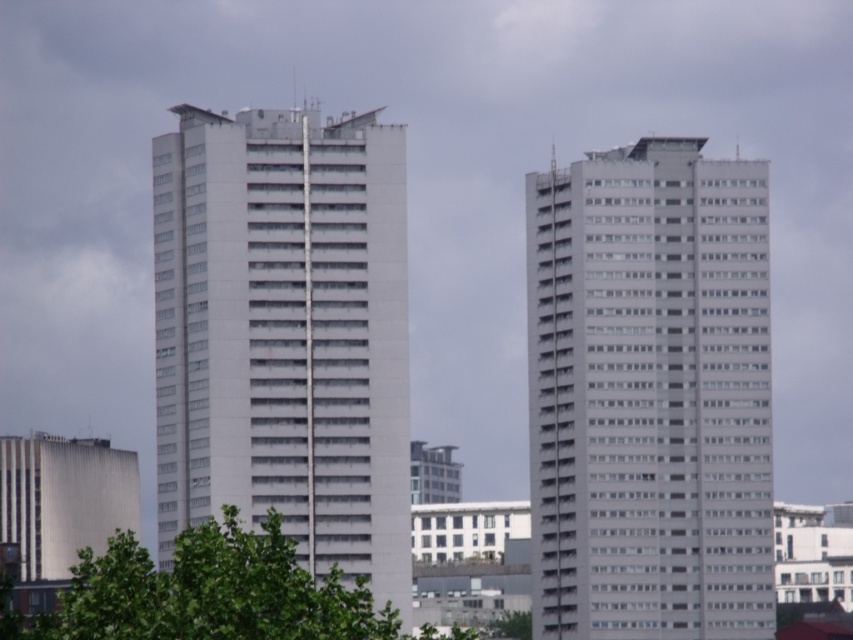
Question: Is white smooth building at right further to the viewer compared to white smooth building at center?

Choices:
 (A) yes
 (B) no

Answer: (A)

Question: Which point appears farthest from the camera in this image?

Choices:
 (A) (610, 214)
 (B) (170, 593)

Answer: (A)

Question: Is white smooth building at center to the right of green leafy tree at center from the viewer's perspective?

Choices:
 (A) yes
 (B) no

Answer: (A)

Question: Among these points, which one is nearest to the camera?

Choices:
 (A) (689, 148)
 (B) (306, 246)

Answer: (B)

Question: Which object appears farthest from the camera in this image?

Choices:
 (A) white smooth building at center
 (B) white smooth building at right
 (C) green leafy tree at center

Answer: (B)

Question: Can you confirm if white smooth building at right is bigger than white smooth building at center?

Choices:
 (A) yes
 (B) no

Answer: (B)